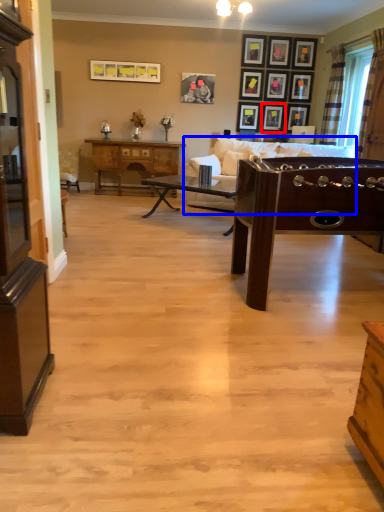
Question: Which point is closer to the camera, picture frame (highlighted by a red box) or studio couch (highlighted by a blue box)?

Choices:
 (A) picture frame
 (B) studio couch

Answer: (B)